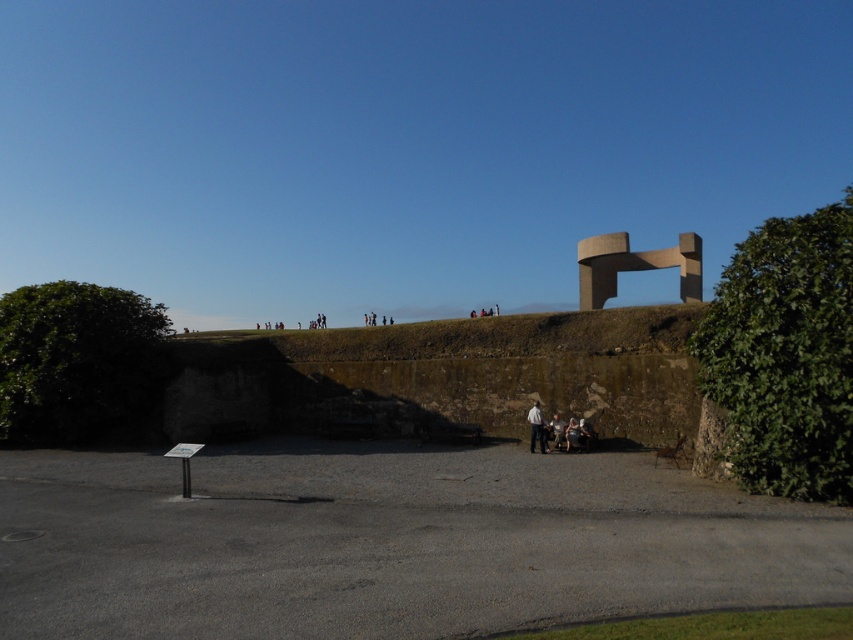
Question: Is green leafy hedge at right below light gray fabric pants at center?

Choices:
 (A) yes
 (B) no

Answer: (B)

Question: Which object is positioned closest to the green leafy hedge at right?

Choices:
 (A) green leafy hedge at left
 (B) light gray fabric pants at center

Answer: (B)

Question: Estimate the real-world distances between objects in this image. Which object is farther from the green leafy hedge at right?

Choices:
 (A) green leafy hedge at left
 (B) light gray fabric pants at center

Answer: (A)

Question: Is green leafy hedge at left below light gray fabric pants at center?

Choices:
 (A) yes
 (B) no

Answer: (B)

Question: Which of the following is the closest to the observer?

Choices:
 (A) (100, 410)
 (B) (769, 396)

Answer: (B)

Question: Is green leafy hedge at right thinner than green leafy hedge at left?

Choices:
 (A) no
 (B) yes

Answer: (B)